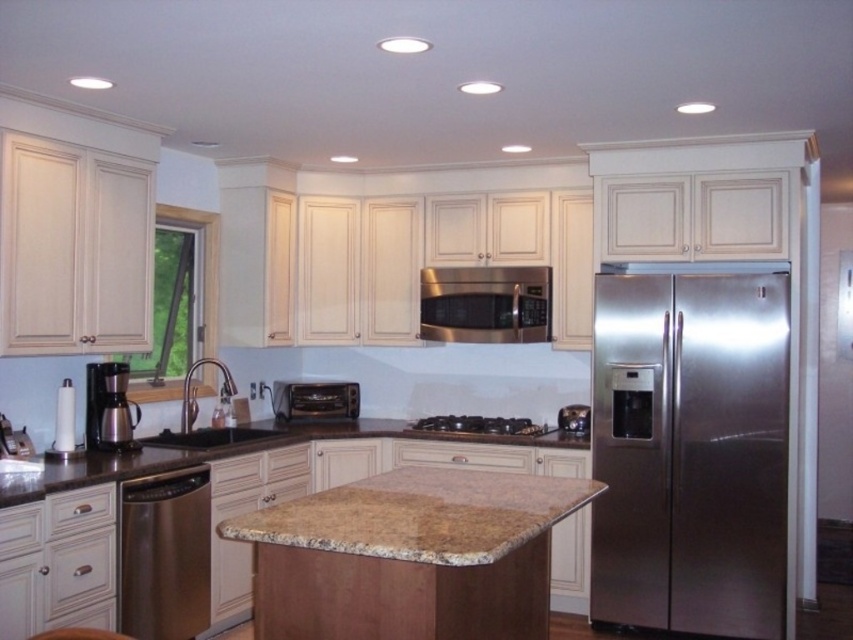
Does metallic coffee maker at lower left appear on the left side of black granite sink at center?

Indeed, metallic coffee maker at lower left is positioned on the left side of black granite sink at center.

Which is above, metallic coffee maker at lower left or black granite sink at center?

Positioned higher is metallic coffee maker at lower left.

This screenshot has width=853, height=640. What do you see at coordinates (108, 406) in the screenshot?
I see `metallic coffee maker at lower left` at bounding box center [108, 406].

Locate an element on the screen. This screenshot has width=853, height=640. metallic coffee maker at lower left is located at coordinates (108, 406).

Does stainless steel dishwasher at lower left have a lesser width compared to granite countertop at center?

Yes.

Between point (137, 596) and point (54, 474), which one is positioned in front?

Point (54, 474)

Identify the location of stainless steel dishwasher at lower left. This screenshot has height=640, width=853. (165, 554).

Which is in front, point (244, 440) or point (509, 314)?

Positioned in front is point (244, 440).

Could you measure the distance between granite countertop at center and satin stainless steel microwave at upper center?

granite countertop at center is 36.28 inches from satin stainless steel microwave at upper center.

Which is behind, point (44, 488) or point (495, 339)?

Positioned behind is point (495, 339).

The height and width of the screenshot is (640, 853). Identify the location of granite countertop at center. (236, 452).